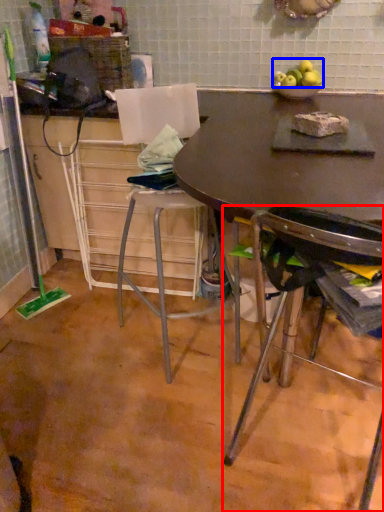
Question: Which object appears farthest to the camera in this image, chair (highlighted by a red box) or apple (highlighted by a blue box)?

Choices:
 (A) chair
 (B) apple

Answer: (B)